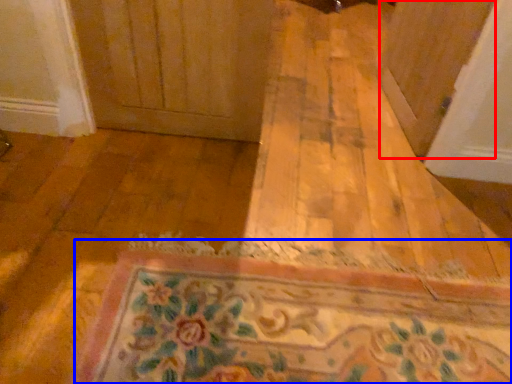
Question: Among these objects, which one is nearest to the camera, screen door (highlighted by a red box) or bath mat (highlighted by a blue box)?

Choices:
 (A) screen door
 (B) bath mat

Answer: (B)